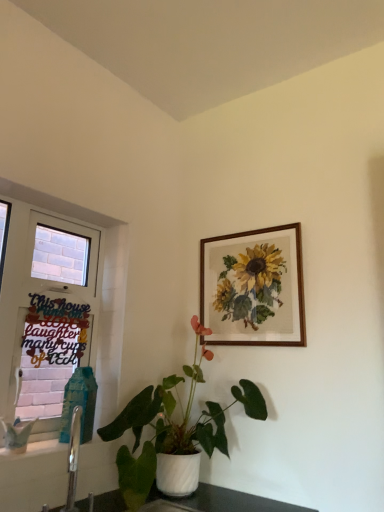
Question: From a real-world perspective, is white glossy pot at center on top of wooden frame at upper right?

Choices:
 (A) no
 (B) yes

Answer: (A)

Question: Is white glossy pot at center facing away from wooden frame at upper right?

Choices:
 (A) yes
 (B) no

Answer: (B)

Question: Considering the relative sizes of white glossy pot at center and wooden frame at upper right in the image provided, is white glossy pot at center bigger than wooden frame at upper right?

Choices:
 (A) no
 (B) yes

Answer: (B)

Question: Is white glossy pot at center facing towards wooden frame at upper right?

Choices:
 (A) yes
 (B) no

Answer: (B)

Question: Considering the relative sizes of white glossy pot at center and wooden frame at upper right in the image provided, is white glossy pot at center shorter than wooden frame at upper right?

Choices:
 (A) yes
 (B) no

Answer: (B)

Question: Considering the relative positions of white glossy pot at center and wooden frame at upper right in the image provided, is white glossy pot at center to the right of wooden frame at upper right from the viewer's perspective?

Choices:
 (A) yes
 (B) no

Answer: (B)

Question: Are black paper sign at left and wooden frame at upper right located far from each other?

Choices:
 (A) yes
 (B) no

Answer: (A)

Question: From the image's perspective, is black paper sign at left on top of wooden frame at upper right?

Choices:
 (A) yes
 (B) no

Answer: (B)

Question: Is black paper sign at left thinner than wooden frame at upper right?

Choices:
 (A) yes
 (B) no

Answer: (A)

Question: Is black paper sign at left in contact with wooden frame at upper right?

Choices:
 (A) no
 (B) yes

Answer: (A)

Question: Does black paper sign at left have a smaller size compared to wooden frame at upper right?

Choices:
 (A) yes
 (B) no

Answer: (A)

Question: Does black paper sign at left have a greater width compared to wooden frame at upper right?

Choices:
 (A) no
 (B) yes

Answer: (A)

Question: Is white glossy pot at center taller than black paper sign at left?

Choices:
 (A) no
 (B) yes

Answer: (B)